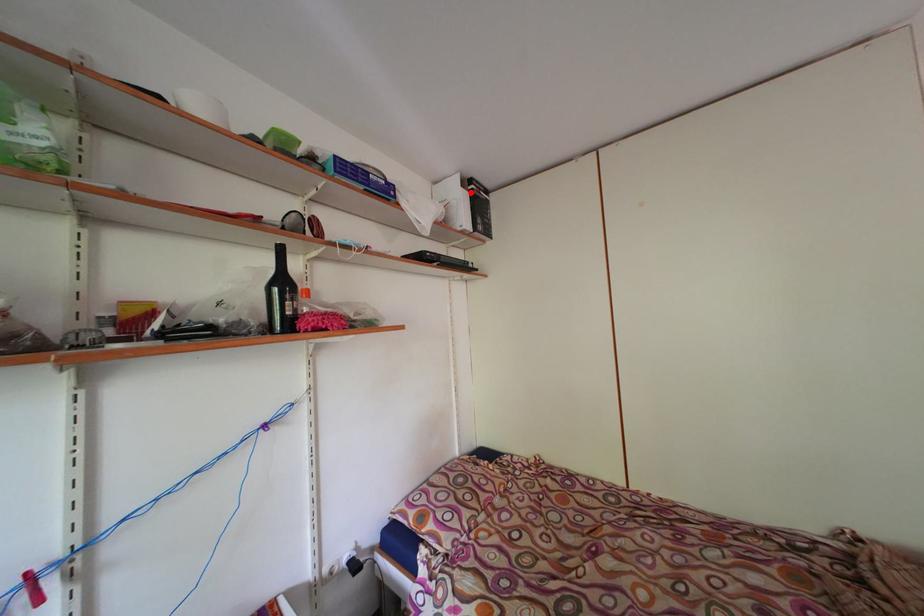
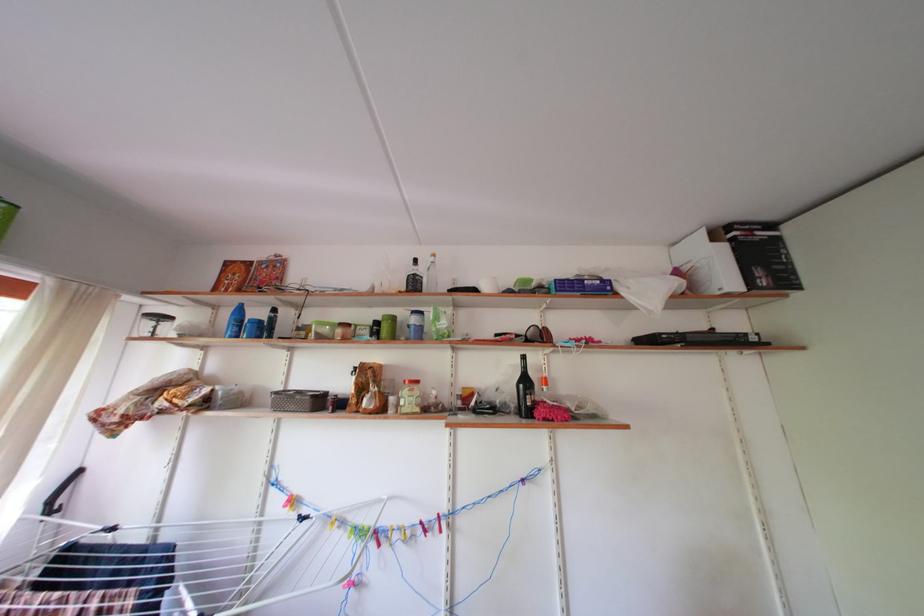
In the second image, find the point that corresponds to the highlighted location in the first image.

(721, 246)